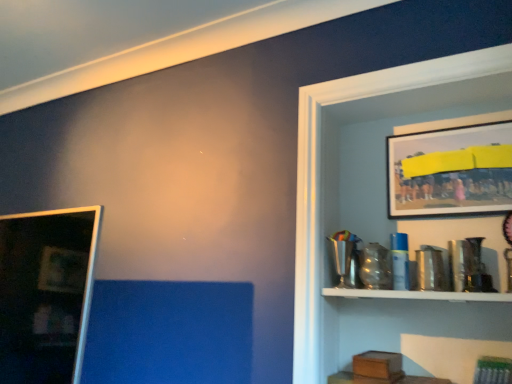
Image resolution: width=512 pixels, height=384 pixels. Identify the location of metallic silver shelf at upper right. (319, 176).

Considering the sizes of objects matte black picture frame at left, arranged as the first picture frame when viewed from the left, and metallic silver shelf at upper right in the image provided, who is wider, matte black picture frame at left, arranged as the first picture frame when viewed from the left, or metallic silver shelf at upper right?

Wider between the two is metallic silver shelf at upper right.

Is matte black picture frame at left, which ranks as the second picture frame in top-to-bottom order, placed right next to metallic silver shelf at upper right?

They are not placed beside each other.

Which is in front, point (26, 249) or point (298, 146)?

The point (26, 249) is in front.

Considering the sizes of metallic silver shelf at upper right and matte black picture frame at left, arranged as the first picture frame when viewed from the left, in the image, is metallic silver shelf at upper right taller or shorter than matte black picture frame at left, arranged as the first picture frame when viewed from the left,?

metallic silver shelf at upper right is taller than matte black picture frame at left, arranged as the first picture frame when viewed from the left.

How many degrees apart are the facing directions of metallic silver shelf at upper right and matte black picture frame at left, which ranks as the second picture frame in top-to-bottom order?

They differ by 0.195 degrees in their facing directions.

Is metallic silver shelf at upper right smaller than matte black picture frame at left, the first picture frame positioned from the bottom?

No, metallic silver shelf at upper right is not smaller than matte black picture frame at left, the first picture frame positioned from the bottom.

Is point (411, 71) more distant than point (72, 318)?

Yes, it is.

Could you measure the distance between metallic silver shelf at upper right and metallic framed picture at upper right, placed as the first picture frame when sorted from top to bottom?

The distance of metallic silver shelf at upper right from metallic framed picture at upper right, placed as the first picture frame when sorted from top to bottom, is 11.70 inches.

Is metallic silver shelf at upper right facing towards metallic framed picture at upper right, the 2th picture frame in the bottom-to-top sequence?

Yes, metallic silver shelf at upper right is oriented towards metallic framed picture at upper right, the 2th picture frame in the bottom-to-top sequence.

In terms of size, does metallic silver shelf at upper right appear bigger or smaller than metallic framed picture at upper right, the first picture frame when ordered from right to left?

Considering their sizes, metallic silver shelf at upper right takes up more space than metallic framed picture at upper right, the first picture frame when ordered from right to left.

Based on the photo, is metallic silver shelf at upper right at the right side of metallic framed picture at upper right, the second picture frame viewed from the left?

Incorrect, metallic silver shelf at upper right is not on the right side of metallic framed picture at upper right, the second picture frame viewed from the left.

Is the surface of matte black picture frame at left, arranged as the first picture frame when viewed from the left, in direct contact with metallic framed picture at upper right, the second picture frame viewed from the left?

There is a gap between matte black picture frame at left, arranged as the first picture frame when viewed from the left, and metallic framed picture at upper right, the second picture frame viewed from the left.

Does matte black picture frame at left, which ranks as the second picture frame in right-to-left order, have a greater height compared to metallic framed picture at upper right, the 2th picture frame in the bottom-to-top sequence?

Yes, matte black picture frame at left, which ranks as the second picture frame in right-to-left order, is taller than metallic framed picture at upper right, the 2th picture frame in the bottom-to-top sequence.

From the image's perspective, between matte black picture frame at left, the first picture frame positioned from the bottom, and metallic framed picture at upper right, placed as the first picture frame when sorted from top to bottom, who is located below?

matte black picture frame at left, the first picture frame positioned from the bottom, from the image's perspective.

Is matte black picture frame at left, which ranks as the second picture frame in top-to-bottom order, thinner than metallic framed picture at upper right, placed as the first picture frame when sorted from top to bottom?

No.

Is metallic framed picture at upper right, the 2th picture frame in the bottom-to-top sequence, facing towards metallic silver shelf at upper right?

Yes, metallic framed picture at upper right, the 2th picture frame in the bottom-to-top sequence, is facing metallic silver shelf at upper right.

Considering the positions of points (457, 132) and (366, 87), is point (457, 132) farther from camera compared to point (366, 87)?

That is True.

Who is more distant, metallic framed picture at upper right, placed as the first picture frame when sorted from top to bottom, or metallic silver shelf at upper right?

metallic framed picture at upper right, placed as the first picture frame when sorted from top to bottom.

Can you confirm if metallic framed picture at upper right, the first picture frame when ordered from right to left, is thinner than metallic silver shelf at upper right?

Yes, metallic framed picture at upper right, the first picture frame when ordered from right to left, is thinner than metallic silver shelf at upper right.

Locate an element on the screen. picture frame below the metallic framed picture at upper right, the first picture frame when ordered from right to left (from the image's perspective) is located at coordinates (46, 293).

Is metallic framed picture at upper right, the second picture frame viewed from the left, oriented towards matte black picture frame at left, the first picture frame positioned from the bottom?

No, metallic framed picture at upper right, the second picture frame viewed from the left, does not turn towards matte black picture frame at left, the first picture frame positioned from the bottom.

Can you confirm if metallic framed picture at upper right, the first picture frame when ordered from right to left, is shorter than matte black picture frame at left, the first picture frame positioned from the bottom?

Yes.

Is point (402, 184) closer to camera compared to point (83, 316)?

No, (402, 184) is further to viewer.

You are a GUI agent. You are given a task and a screenshot of the screen. Output one action in this format:
    pyautogui.click(x=<x>, y=<y>)
    Task: Click on the shelf in front of the matte black picture frame at left, arranged as the first picture frame when viewed from the left
    The image size is (512, 384).
    Given the screenshot: What is the action you would take?
    pyautogui.click(x=319, y=176)

There is a matte black picture frame at left, arranged as the first picture frame when viewed from the left. What are the coordinates of `shelf above it (from a real-world perspective)` in the screenshot? It's located at (319, 176).

Estimate the real-world distances between objects in this image. Which object is closer to metallic framed picture at upper right, the first picture frame when ordered from right to left, metallic silver shelf at upper right or matte black picture frame at left, which ranks as the second picture frame in top-to-bottom order?

The object closer to metallic framed picture at upper right, the first picture frame when ordered from right to left, is metallic silver shelf at upper right.

When comparing their distances from metallic framed picture at upper right, the second picture frame viewed from the left, does matte black picture frame at left, which ranks as the second picture frame in top-to-bottom order, or metallic silver shelf at upper right seem closer?

Based on the image, metallic silver shelf at upper right appears to be nearer to metallic framed picture at upper right, the second picture frame viewed from the left.

Based on their spatial positions, is metallic framed picture at upper right, the second picture frame viewed from the left, or matte black picture frame at left, the first picture frame positioned from the bottom, further from metallic silver shelf at upper right?

matte black picture frame at left, the first picture frame positioned from the bottom, lies further to metallic silver shelf at upper right than the other object.

Estimate the real-world distances between objects in this image. Which object is closer to matte black picture frame at left, the first picture frame positioned from the bottom, metallic silver shelf at upper right or metallic framed picture at upper right, placed as the first picture frame when sorted from top to bottom?

metallic silver shelf at upper right.

Estimate the real-world distances between objects in this image. Which object is closer to matte black picture frame at left, the first picture frame positioned from the bottom, metallic framed picture at upper right, the second picture frame viewed from the left, or metallic silver shelf at upper right?

metallic silver shelf at upper right is positioned closer to the anchor matte black picture frame at left, the first picture frame positioned from the bottom.

Which object lies nearer to the anchor point metallic silver shelf at upper right, matte black picture frame at left, which ranks as the second picture frame in top-to-bottom order, or metallic framed picture at upper right, placed as the first picture frame when sorted from top to bottom?

The object closer to metallic silver shelf at upper right is metallic framed picture at upper right, placed as the first picture frame when sorted from top to bottom.

I want to click on shelf between matte black picture frame at left, which ranks as the second picture frame in top-to-bottom order, and metallic framed picture at upper right, placed as the first picture frame when sorted from top to bottom, from left to right, so (319, 176).